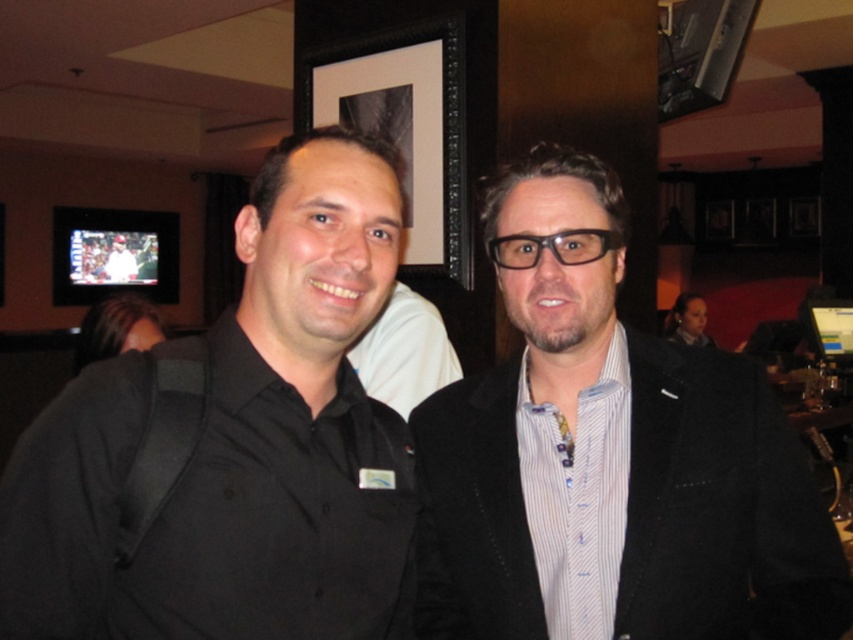
Question: Observing the image, what is the correct spatial positioning of matte black suit at center in reference to black matte shirt at left?

Choices:
 (A) below
 (B) above

Answer: (A)

Question: Among these points, which one is farthest from the camera?

Choices:
 (A) (170, 605)
 (B) (619, 452)

Answer: (B)

Question: In this image, where is matte black suit at center located relative to black matte shirt at left?

Choices:
 (A) above
 (B) below

Answer: (B)

Question: Does matte black suit at center have a greater width compared to black matte shirt at left?

Choices:
 (A) yes
 (B) no

Answer: (A)

Question: Which of the following is the closest to the observer?

Choices:
 (A) matte black suit at center
 (B) black matte shirt at left

Answer: (B)